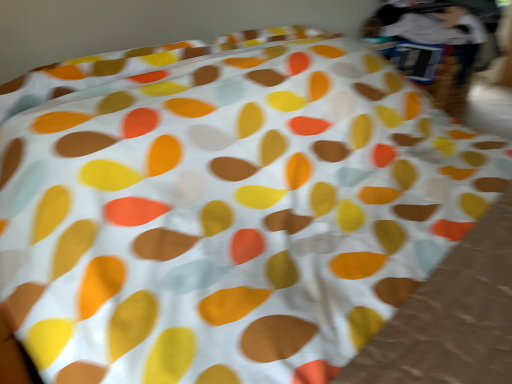
The image size is (512, 384). What do you see at coordinates (445, 40) in the screenshot? I see `velvet blue bean bag chair at upper right` at bounding box center [445, 40].

You are a GUI agent. You are given a task and a screenshot of the screen. Output one action in this format:
    pyautogui.click(x=<x>, y=<y>)
    Task: Click on the velvet blue bean bag chair at upper right
    The width and height of the screenshot is (512, 384).
    Given the screenshot: What is the action you would take?
    pyautogui.click(x=445, y=40)

Where is `velvet blue bean bag chair at upper right`? This screenshot has height=384, width=512. velvet blue bean bag chair at upper right is located at coordinates (445, 40).